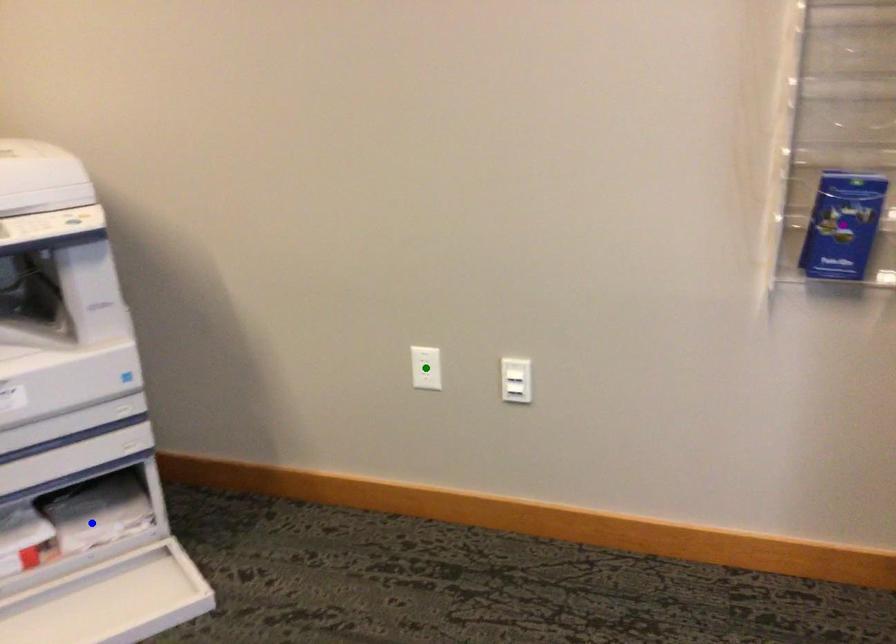
Order these from farthest to nearest:
green point
purple point
blue point

1. blue point
2. green point
3. purple point